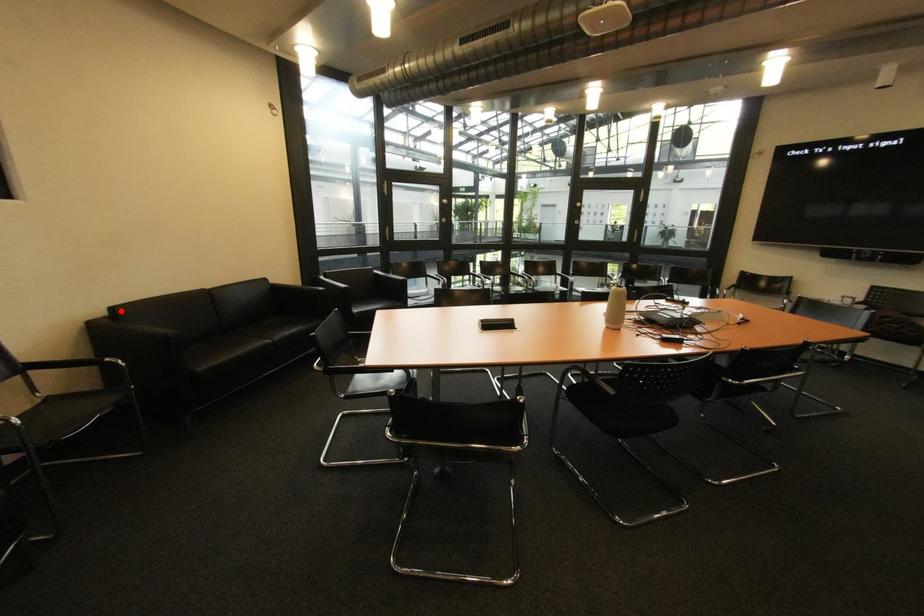
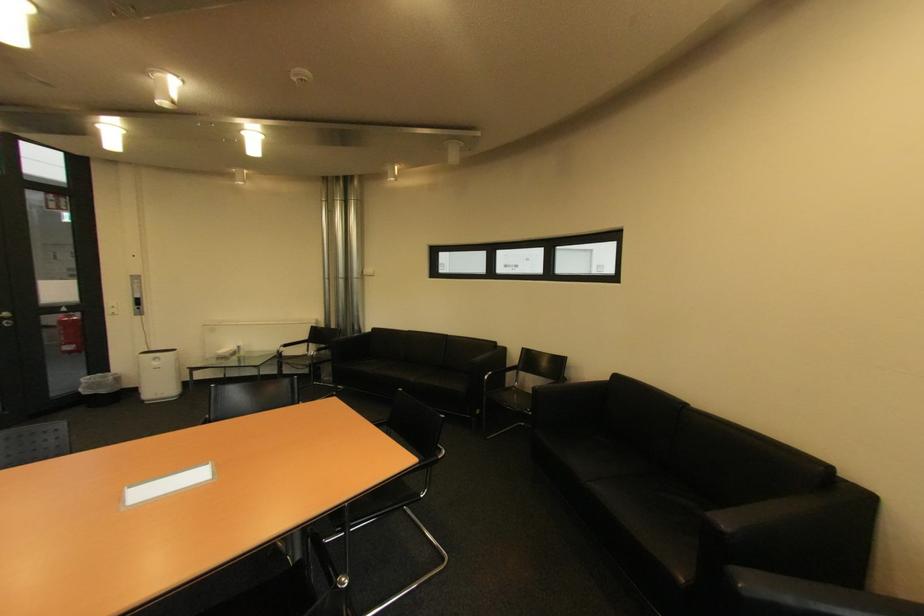
The point at the highlighted location is marked in the first image. Where is the corresponding point in the second image?

(625, 378)